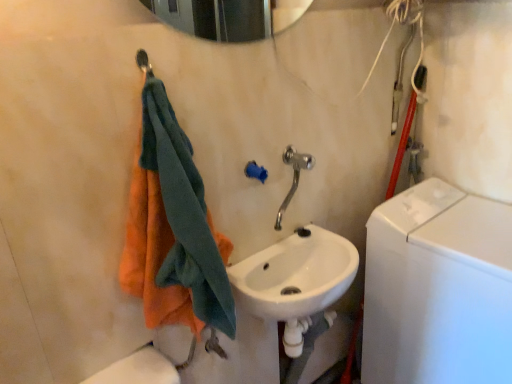
Image resolution: width=512 pixels, height=384 pixels. Identify the location of white glossy washing machine at right. point(438,288).

Describe the element at coordinates (293, 177) in the screenshot. I see `polished chrome faucet at center` at that location.

The image size is (512, 384). What do you see at coordinates (144, 62) in the screenshot? I see `metallic silver shower at upper left` at bounding box center [144, 62].

The width and height of the screenshot is (512, 384). I want to click on white glossy washing machine at right, so click(438, 288).

Considering the relative positions of white glossy sink at center and orange cotton towel at left in the image provided, is white glossy sink at center behind orange cotton towel at left?

Yes, it is behind orange cotton towel at left.

Which is more to the right, white glossy sink at center or orange cotton towel at left?

white glossy sink at center.

Would you say white glossy sink at center contains orange cotton towel at left?

No, orange cotton towel at left is not surrounded by white glossy sink at center.

From the image's perspective, between white glossy sink at center and orange cotton towel at left, which one is located above?

From the image's view, orange cotton towel at left is above.

Does metallic silver shower at upper left have a greater height compared to polished chrome faucet at center?

No, metallic silver shower at upper left is not taller than polished chrome faucet at center.

Is metallic silver shower at upper left surrounding polished chrome faucet at center?

No.

Which object is closer to the camera taking this photo, metallic silver shower at upper left or polished chrome faucet at center?

Positioned in front is metallic silver shower at upper left.

Considering the sizes of white glossy sink at center and polished chrome faucet at center in the image, is white glossy sink at center taller or shorter than polished chrome faucet at center?

In the image, white glossy sink at center appears to be shorter than polished chrome faucet at center.

Can you confirm if white glossy sink at center is positioned to the left of polished chrome faucet at center?

In fact, white glossy sink at center is to the right of polished chrome faucet at center.

At what (x,y) coordinates should I click in order to perform the action: click on plumbing fixture above the white glossy sink at center (from a real-world perspective). Please return your answer as a coordinate pair (x, y). Image resolution: width=512 pixels, height=384 pixels. Looking at the image, I should click on (293, 177).

Based on the photo, would you say white glossy washing machine at right is a long distance from metallic silver shower at upper left?

white glossy washing machine at right is far away from metallic silver shower at upper left.

Considering the relative positions of white glossy washing machine at right and metallic silver shower at upper left in the image provided, is white glossy washing machine at right to the left of metallic silver shower at upper left from the viewer's perspective?

Incorrect, white glossy washing machine at right is not on the left side of metallic silver shower at upper left.

Does white glossy washing machine at right have a greater height compared to metallic silver shower at upper left?

Indeed, white glossy washing machine at right has a greater height compared to metallic silver shower at upper left.

Looking at this image, is white glossy washing machine at right facing towards metallic silver shower at upper left?

No, white glossy washing machine at right does not turn towards metallic silver shower at upper left.

Could you tell me if white glossy sink at center is facing metallic silver shower at upper left?

No, white glossy sink at center is not facing towards metallic silver shower at upper left.

In the image, is white glossy sink at center positioned in front of or behind metallic silver shower at upper left?

Clearly, white glossy sink at center is behind metallic silver shower at upper left.

Is white glossy sink at center completely or partially outside of metallic silver shower at upper left?

Yes, white glossy sink at center is outside of metallic silver shower at upper left.

Between white glossy sink at center and metallic silver shower at upper left, which one has smaller size?

Smaller between the two is metallic silver shower at upper left.

From the picture: Between polished chrome faucet at center and metallic silver shower at upper left, which one has smaller size?

metallic silver shower at upper left.

Locate an element on the screen. shower that appears above the polished chrome faucet at center (from a real-world perspective) is located at coordinates (144, 62).

Who is taller, polished chrome faucet at center or metallic silver shower at upper left?

With more height is polished chrome faucet at center.

From a real-world perspective, is white glossy washing machine at right physically located above or below polished chrome faucet at center?

From a real-world perspective, white glossy washing machine at right is physically below polished chrome faucet at center.

Which of these two, white glossy washing machine at right or polished chrome faucet at center, stands shorter?

polished chrome faucet at center.

Which is closer to the camera, (480, 351) or (285, 155)?

The point (285, 155) is closer to the camera.

Consider the image. From the image's perspective, is white glossy washing machine at right located above or below polished chrome faucet at center?

Clearly, from the image's perspective, white glossy washing machine at right is below polished chrome faucet at center.

The height and width of the screenshot is (384, 512). I want to click on towel located in front of the white glossy sink at center, so click(173, 230).

At what (x,y) coordinates should I click in order to perform the action: click on shower lying above the polished chrome faucet at center (from the image's perspective). Please return your answer as a coordinate pair (x, y). Looking at the image, I should click on (144, 62).

Which object lies nearer to the anchor point white glossy washing machine at right, orange cotton towel at left or white glossy sink at center?

The object closer to white glossy washing machine at right is white glossy sink at center.

Considering their positions, is white glossy sink at center positioned further to orange cotton towel at left than white glossy washing machine at right?

white glossy washing machine at right.

From the image, which object appears to be nearer to polished chrome faucet at center, white glossy sink at center or orange cotton towel at left?

white glossy sink at center lies closer to polished chrome faucet at center than the other object.

Based on their spatial positions, is polished chrome faucet at center or white glossy washing machine at right further from metallic silver shower at upper left?

The object further to metallic silver shower at upper left is white glossy washing machine at right.

When comparing their distances from white glossy washing machine at right, does metallic silver shower at upper left or polished chrome faucet at center seem closer?

Based on the image, polished chrome faucet at center appears to be nearer to white glossy washing machine at right.

From the image, which object appears to be farther from white glossy washing machine at right, white glossy sink at center or orange cotton towel at left?

orange cotton towel at left.

Looking at the image, which one is located closer to polished chrome faucet at center, orange cotton towel at left or metallic silver shower at upper left?

orange cotton towel at left lies closer to polished chrome faucet at center than the other object.

Based on their spatial positions, is metallic silver shower at upper left or orange cotton towel at left further from white glossy washing machine at right?

The object further to white glossy washing machine at right is metallic silver shower at upper left.

You are a GUI agent. You are given a task and a screenshot of the screen. Output one action in this format:
    pyautogui.click(x=<x>, y=<y>)
    Task: Click on the plumbing fixture located between orange cotton towel at left and white glossy washing machine at right in the left-right direction
    Image resolution: width=512 pixels, height=384 pixels.
    Given the screenshot: What is the action you would take?
    pyautogui.click(x=293, y=177)

What are the coordinates of `plumbing fixture between metallic silver shower at upper left and white glossy sink at center from top to bottom` in the screenshot? It's located at (293, 177).

Where is `plumbing fixture between metallic silver shower at upper left and white glossy washing machine at right`? The image size is (512, 384). plumbing fixture between metallic silver shower at upper left and white glossy washing machine at right is located at coordinates (293, 177).

Identify the location of sink situated between polished chrome faucet at center and white glossy washing machine at right from left to right. [295, 275].